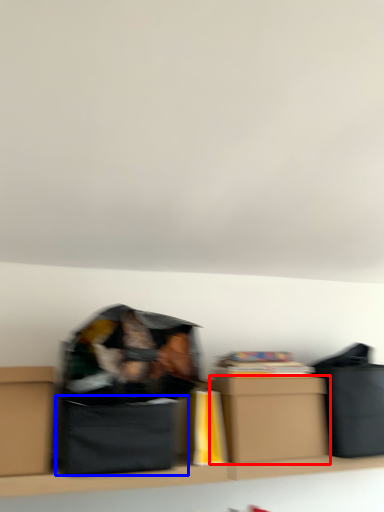
Question: Which of the following is the closest to the observer, box (highlighted by a red box) or cardboard box (highlighted by a blue box)?

Choices:
 (A) box
 (B) cardboard box

Answer: (B)